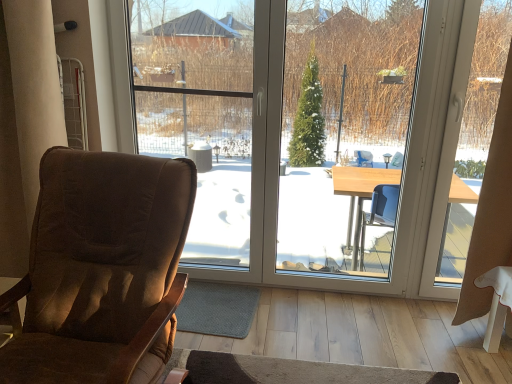
Question: Is beige fabric curtain at right placed right next to transparent glass window at center?

Choices:
 (A) no
 (B) yes

Answer: (A)

Question: Can you confirm if beige fabric curtain at right is positioned to the left of transparent glass window at center?

Choices:
 (A) yes
 (B) no

Answer: (B)

Question: Considering the relative sizes of beige fabric curtain at right and transparent glass window at center in the image provided, is beige fabric curtain at right thinner than transparent glass window at center?

Choices:
 (A) no
 (B) yes

Answer: (A)

Question: Does beige fabric curtain at right have a greater height compared to transparent glass window at center?

Choices:
 (A) yes
 (B) no

Answer: (B)

Question: Does beige fabric curtain at right appear on the right side of transparent glass window at center?

Choices:
 (A) no
 (B) yes

Answer: (B)

Question: Is beige fabric curtain at right aimed at transparent glass window at center?

Choices:
 (A) no
 (B) yes

Answer: (A)

Question: From the image's perspective, is beige fabric curtain at right above brown fabric chair at left?

Choices:
 (A) no
 (B) yes

Answer: (B)

Question: Is beige fabric curtain at right not close to brown fabric chair at left?

Choices:
 (A) no
 (B) yes

Answer: (B)

Question: Is beige fabric curtain at right not inside brown fabric chair at left?

Choices:
 (A) no
 (B) yes

Answer: (B)

Question: Is beige fabric curtain at right to the left of brown fabric chair at left from the viewer's perspective?

Choices:
 (A) no
 (B) yes

Answer: (A)

Question: Is beige fabric curtain at right surrounding brown fabric chair at left?

Choices:
 (A) no
 (B) yes

Answer: (A)

Question: From a real-world perspective, is beige fabric curtain at right on top of brown fabric chair at left?

Choices:
 (A) yes
 (B) no

Answer: (A)

Question: Is beige fabric curtain at right not near transparent glass window screen at center?

Choices:
 (A) yes
 (B) no

Answer: (A)